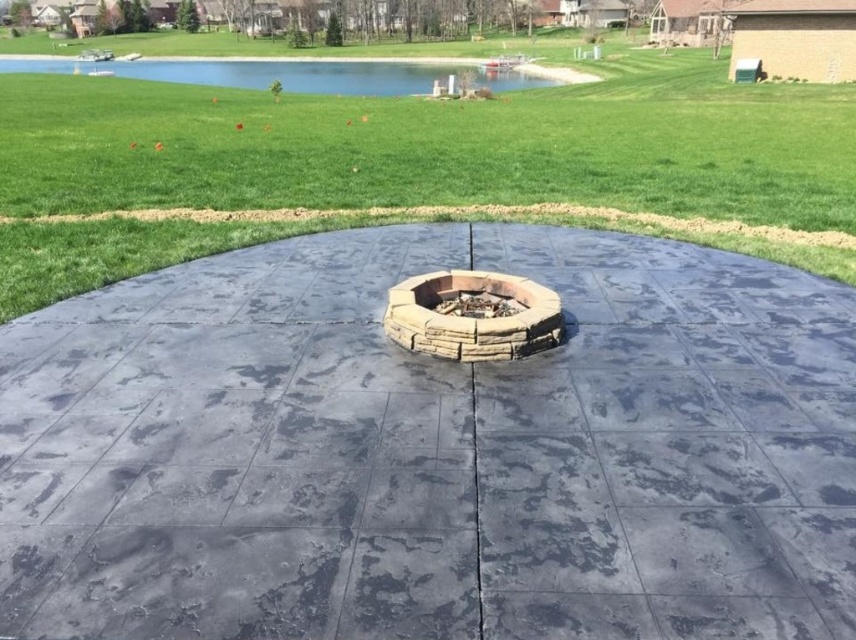
You are planning to install a new fire pit in the center of the circular patio. The current fire pit is the gray concrete fire pit at center. You want to replace it with a taller fire pit. Considering the green grass at center is already present, will the new taller fire pit obstruct the view of the grass?

The gray concrete fire pit at center is currently shorter than the green grass at center. If you replace it with a taller fire pit, the new fire pit may obstruct the view of the green grass at center since it would be taller than the existing grass.

You are planning to place a round table in the center of the circular patio. The table has a diameter of 1.2 meters. The gray concrete fire pit at center and the stone textured fire pit at center are both located at the center. Which fire pit would leave more space around it for the table?

The gray concrete fire pit at center is bigger than the stone textured fire pit at center, so placing the table around the smaller stone textured fire pit at center would leave more space for the table.